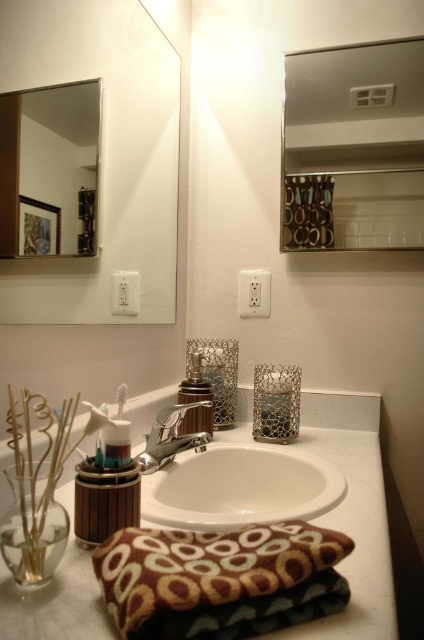
You are organizing a bathroom and need to place a new decorative item. The item must be placed on the white matte counter top at center without blocking the clear glass mirror at upper left. Is this possible?

Yes, since the white matte counter top at center is located below the clear glass mirror at upper left, placing the item on the counter won

You are standing in the bathroom and want to place a small decorative item between the metallic silver mirror at upper center and the brown textured pillow at lower center. Based on their positions, where should you place it?

You should place the small decorative item between the metallic silver mirror at upper center and the brown textured pillow at lower center, as the mirror is positioned over the pillow, creating a vertical space between them.

You are organizing a bathroom and need to place a large decorative item. Which object between the white matte counter top at center and the clear glass mirror at upper left has enough space to accommodate it?

The white matte counter top at center is bigger than the clear glass mirror at upper left, so it has enough space to accommodate the large decorative item.